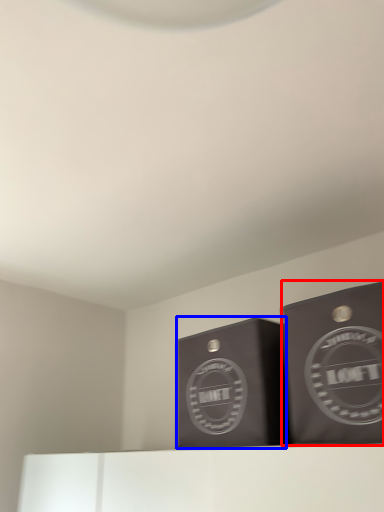
Question: Which object is further to the camera taking this photo, cardboard box (highlighted by a red box) or cardboard box (highlighted by a blue box)?

Choices:
 (A) cardboard box
 (B) cardboard box

Answer: (B)